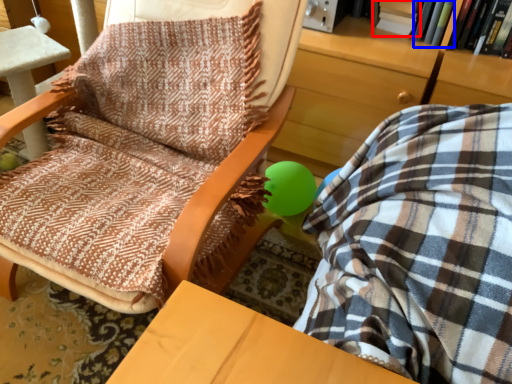
Question: Which point is closer to the camera, book (highlighted by a red box) or book (highlighted by a blue box)?

Choices:
 (A) book
 (B) book

Answer: (B)